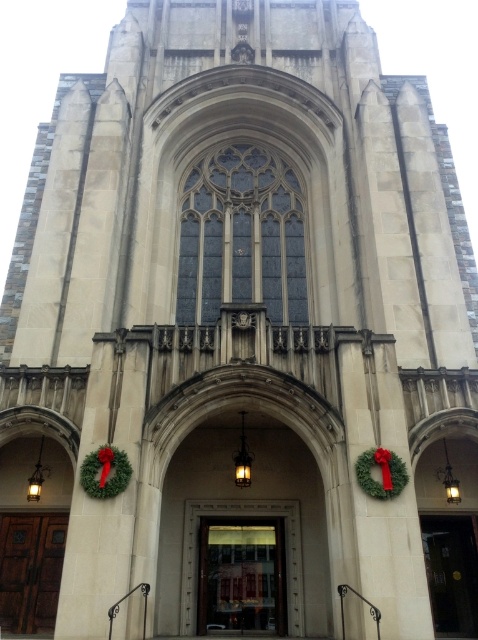
You are a delivery person trying to deliver a package to the building. The package is too large to fit through the wooden door at center. Can you use the green matte wreath at lower center as an alternative entrance?

The wooden door at center is larger than the green matte wreath at lower center, so the wreath cannot be used as an entrance since it is smaller and not an opening.

Based on the photo, you are standing in front of the grand historic building and want to enter through the wooden door at center. Based on the coordinates provided, can you determine the door is located on the left or right side of the building?

The wooden door at center is located at coordinates point (241, 576), which places it in the central position of the building, so it is neither on the left nor right side but exactly in the middle.